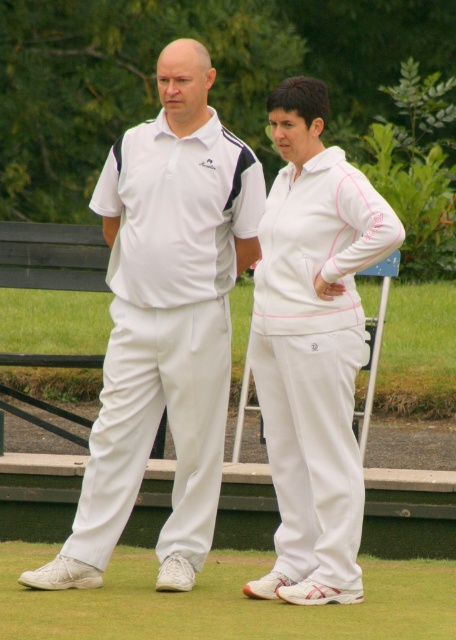
Is point (307, 451) positioned after point (171, 624)?

Yes, point (307, 451) is farther from viewer.

You are a GUI agent. You are given a task and a screenshot of the screen. Output one action in this format:
    pyautogui.click(x=<x>, y=<y>)
    Task: Click on the white matte tracksuit at center
    Image resolution: width=456 pixels, height=640 pixels.
    Given the screenshot: What is the action you would take?
    pyautogui.click(x=312, y=348)

What are the coordinates of `white matte tracksuit at center` in the screenshot? It's located at click(312, 348).

Image resolution: width=456 pixels, height=640 pixels. What do you see at coordinates (165, 323) in the screenshot? I see `white cotton polo shirt at center` at bounding box center [165, 323].

Who is lower down, white cotton polo shirt at center or white fabric pants at lower center?

Positioned lower is white fabric pants at lower center.

Where is `white cotton polo shirt at center`? The image size is (456, 640). white cotton polo shirt at center is located at coordinates (165, 323).

Is white cotton polo shirt at center positioned behind white matte tracksuit at center?

Yes, it is behind white matte tracksuit at center.

In order to click on white cotton polo shirt at center in this screenshot , I will do `click(165, 323)`.

This screenshot has width=456, height=640. Find the location of `white cotton polo shirt at center`. white cotton polo shirt at center is located at coordinates (165, 323).